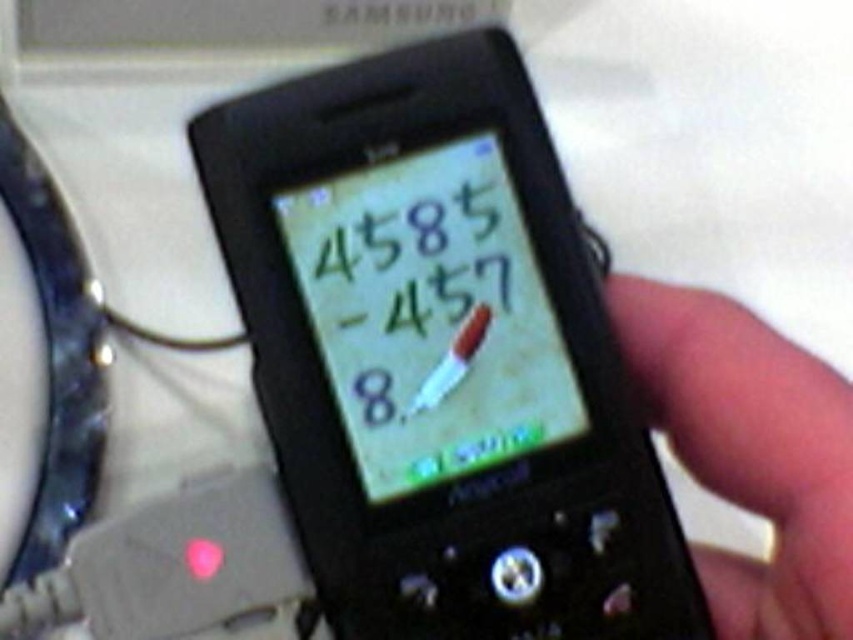
Question: Which object is farther from the camera taking this photo?

Choices:
 (A) black plastic phone at center
 (B) black matte phone at right

Answer: (A)

Question: Which of the following is the farthest from the observer?

Choices:
 (A) (546, 570)
 (B) (672, 355)

Answer: (B)

Question: Is black plastic phone at center to the right of black matte phone at right from the viewer's perspective?

Choices:
 (A) no
 (B) yes

Answer: (A)

Question: Is black plastic phone at center closer to camera compared to black matte phone at right?

Choices:
 (A) no
 (B) yes

Answer: (A)

Question: Can you confirm if black plastic phone at center is positioned to the left of black matte phone at right?

Choices:
 (A) no
 (B) yes

Answer: (B)

Question: Which object is farther from the camera taking this photo?

Choices:
 (A) black matte phone at right
 (B) black plastic phone at center

Answer: (B)